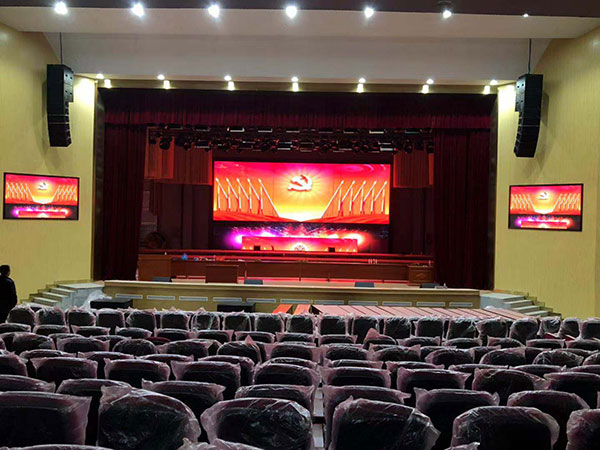
At what (x,y) coordinates should I click in order to perform the action: click on white ceiling. Please return your answer as a coordinate pair (x, y). The height and width of the screenshot is (450, 600). Looking at the image, I should click on (321, 41).